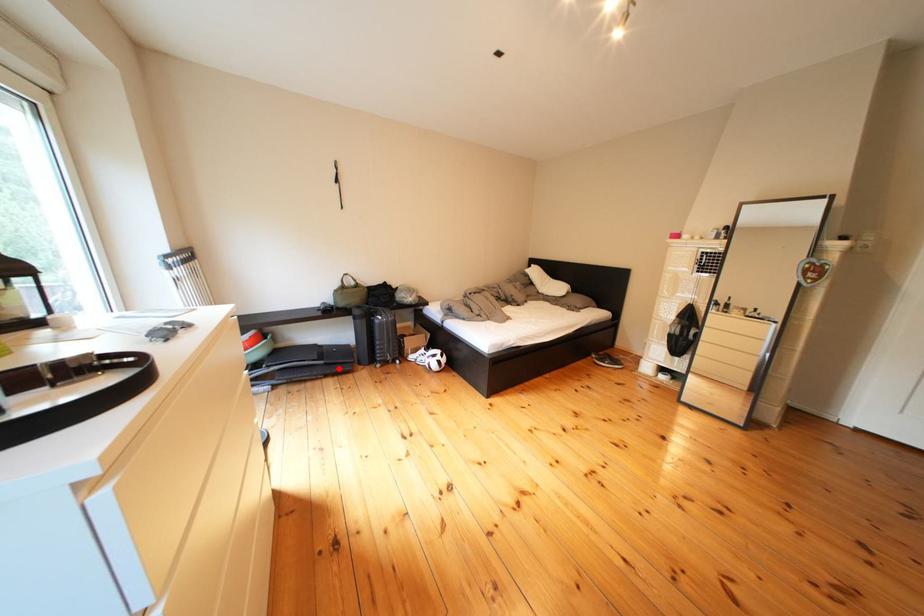
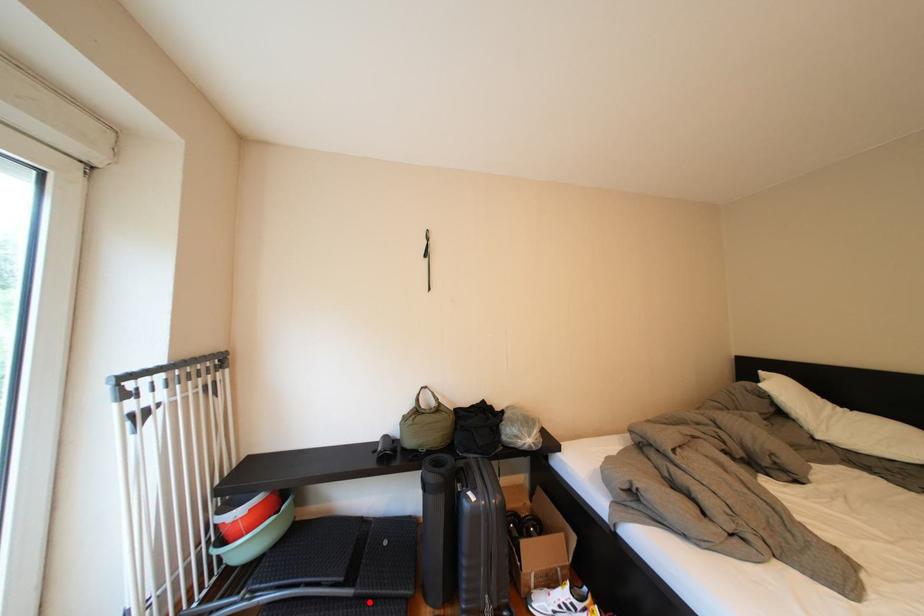
From the picture: I am providing you with two images of the same scene from different viewpoints. A red point is marked on the first image and another point is marked on the second image. Are the points marked in image1 and image2 representing the same 3D position?

Yes